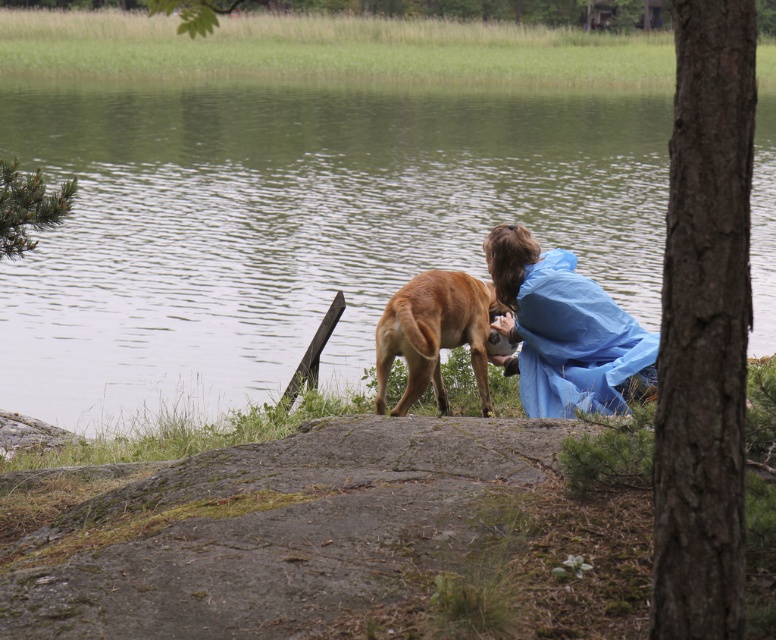
You are standing at the point marked by the coordinates point (293, 225) in the image. What do you see around you?

You are standing on green water at center marked by the coordinates point (293, 225).

You are standing at the edge of the lake and want to take a photo of the green water at center. Where exactly should you aim your camera to capture it?

You should aim your camera at the coordinates point (293, 225) to capture the green water at center.

You are a hiker who wants to cross the green water at center while wearing the blue waterproof jacket at center. Considering the height of the water, will the jacket stay dry?

The green water at center has a greater height compared to blue waterproof jacket at center. Since the water is taller than the jacket, the jacket will not stay dry as the water will go over it.